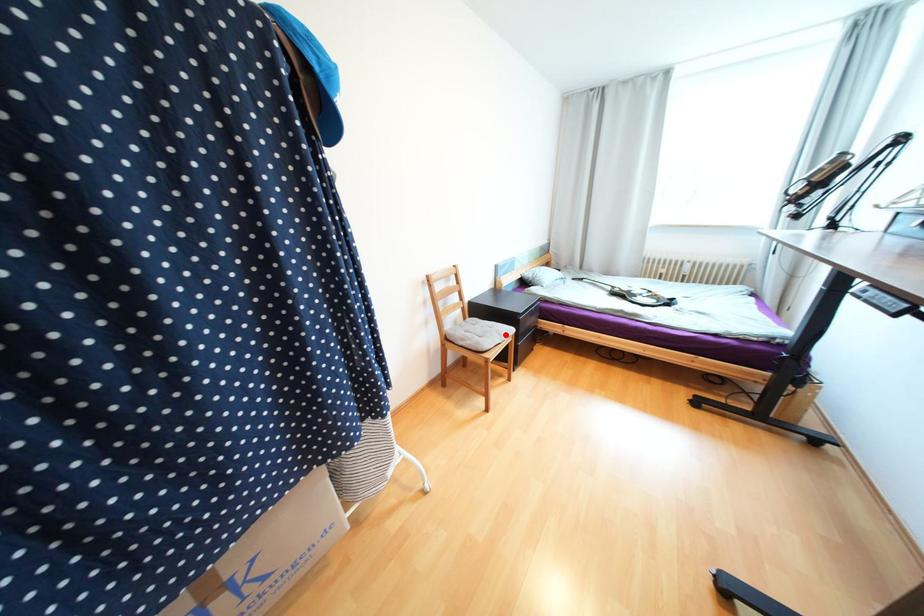
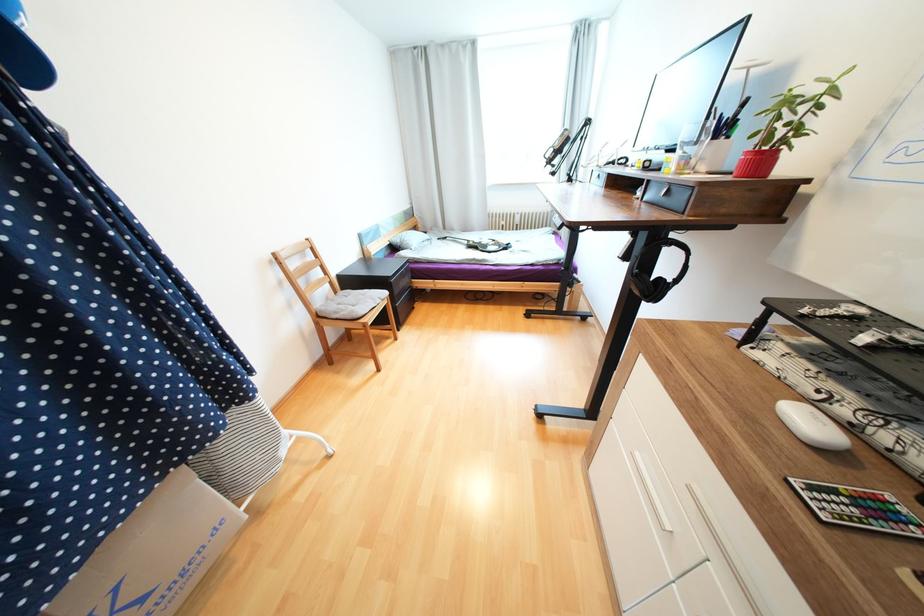
Question: I am providing you with two images of the same scene from different viewpoints. Image1 has a red point marked. In image2, the corresponding 3D location appears at what relative position? Reply with the corresponding letter.

Choices:
 (A) Closer
 (B) Farther

Answer: (A)